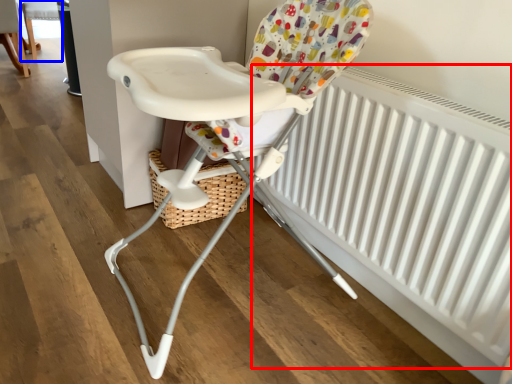
Question: Which point is closer to the camera, radiator (highlighted by a red box) or chair (highlighted by a blue box)?

Choices:
 (A) radiator
 (B) chair

Answer: (A)